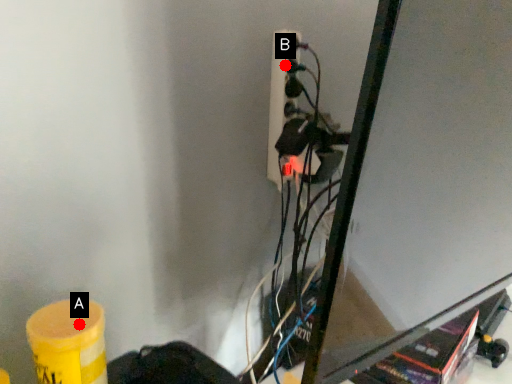
Question: Two points are circled on the image, labeled by A and B beside each circle. Which point is farther from the camera taking this photo?

Choices:
 (A) A is further
 (B) B is further

Answer: (B)